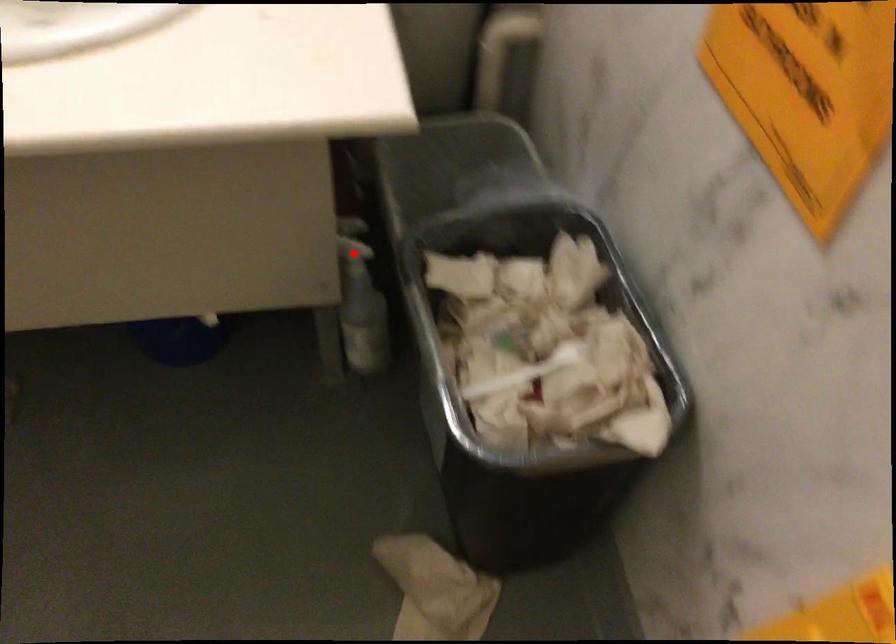
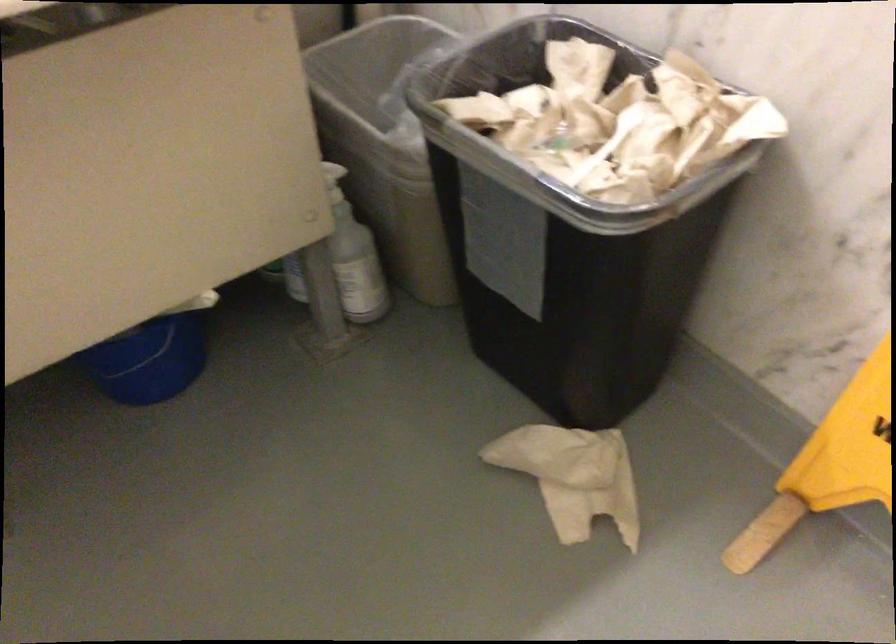
In the second image, find the point that corresponds to the highlighted location in the first image.

(333, 182)